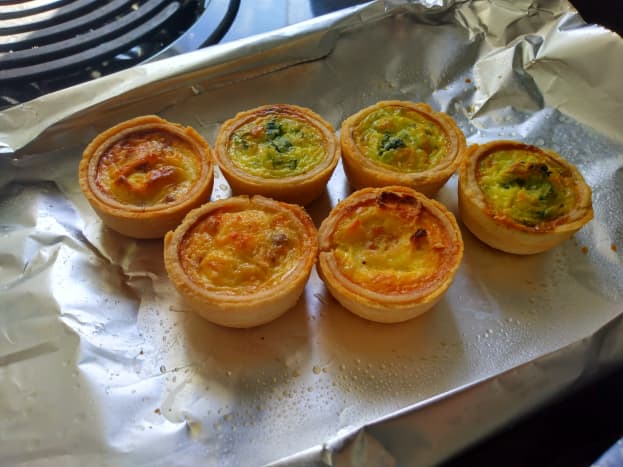
Identify the location of top of the stove. (265, 18).